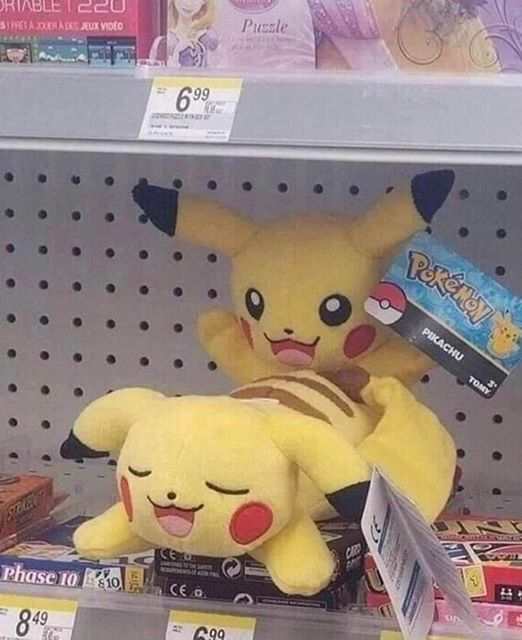
I want to click on board game, so click(x=10, y=495), click(x=19, y=534), click(x=133, y=575), click(x=195, y=557), click(x=204, y=580), click(x=494, y=571), click(x=502, y=619), click(x=437, y=609), click(x=382, y=605), click(x=369, y=575).